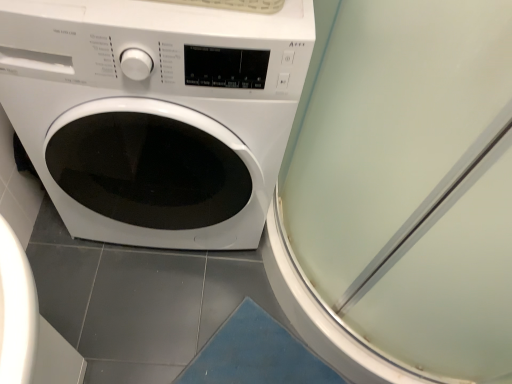
Question: Is transparent plastic screen door at upper right not within white glossy washing machine at center?

Choices:
 (A) no
 (B) yes

Answer: (B)

Question: Is transparent plastic screen door at upper right in front of white glossy washing machine at center?

Choices:
 (A) no
 (B) yes

Answer: (B)

Question: Considering the relative sizes of transparent plastic screen door at upper right and white glossy washing machine at center in the image provided, is transparent plastic screen door at upper right smaller than white glossy washing machine at center?

Choices:
 (A) no
 (B) yes

Answer: (B)

Question: Considering the relative sizes of transparent plastic screen door at upper right and white glossy washing machine at center in the image provided, is transparent plastic screen door at upper right thinner than white glossy washing machine at center?

Choices:
 (A) no
 (B) yes

Answer: (A)

Question: Can you confirm if transparent plastic screen door at upper right is positioned to the right of white glossy washing machine at center?

Choices:
 (A) yes
 (B) no

Answer: (A)

Question: Can you confirm if transparent plastic screen door at upper right is positioned to the left of white glossy washing machine at center?

Choices:
 (A) no
 (B) yes

Answer: (A)

Question: From the image's perspective, is white glossy washing machine at center under transparent plastic screen door at upper right?

Choices:
 (A) no
 (B) yes

Answer: (A)

Question: Would you consider white glossy washing machine at center to be distant from transparent plastic screen door at upper right?

Choices:
 (A) no
 (B) yes

Answer: (A)

Question: Is white glossy washing machine at center looking in the opposite direction of transparent plastic screen door at upper right?

Choices:
 (A) no
 (B) yes

Answer: (A)

Question: Is white glossy washing machine at center bigger than transparent plastic screen door at upper right?

Choices:
 (A) no
 (B) yes

Answer: (B)

Question: From the image's perspective, is white glossy washing machine at center on top of transparent plastic screen door at upper right?

Choices:
 (A) yes
 (B) no

Answer: (A)

Question: Is white glossy washing machine at center positioned in front of transparent plastic screen door at upper right?

Choices:
 (A) yes
 (B) no

Answer: (B)

Question: Is white glossy washing machine at center inside the boundaries of transparent plastic screen door at upper right, or outside?

Choices:
 (A) outside
 (B) inside

Answer: (A)